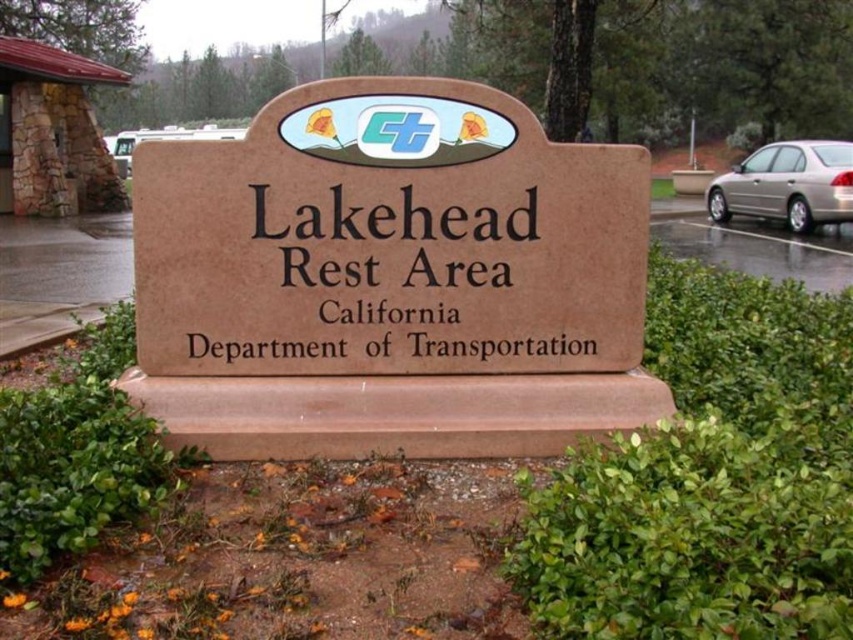
Question: Among these points, which one is farthest from the camera?

Choices:
 (A) (751, 163)
 (B) (497, 129)
 (C) (7, 301)
 (D) (0, 125)

Answer: (A)

Question: Can you confirm if brown stone sign at center is bigger than metallic silver car at right?

Choices:
 (A) yes
 (B) no

Answer: (B)

Question: Which object is closer to the camera taking this photo?

Choices:
 (A) brown stone sign at center
 (B) matte plastic sign at center
 (C) matte plastic logo at center

Answer: (A)

Question: Which point is farther to the camera?

Choices:
 (A) metallic silver car at right
 (B) brown stone sign at center
 (C) matte plastic logo at center
 (D) brown concrete sign at center

Answer: (D)

Question: Does metallic silver car at right appear on the left side of brushed stone archway at left?

Choices:
 (A) no
 (B) yes

Answer: (A)

Question: Is brown concrete sign at center above brushed stone archway at left?

Choices:
 (A) yes
 (B) no

Answer: (B)